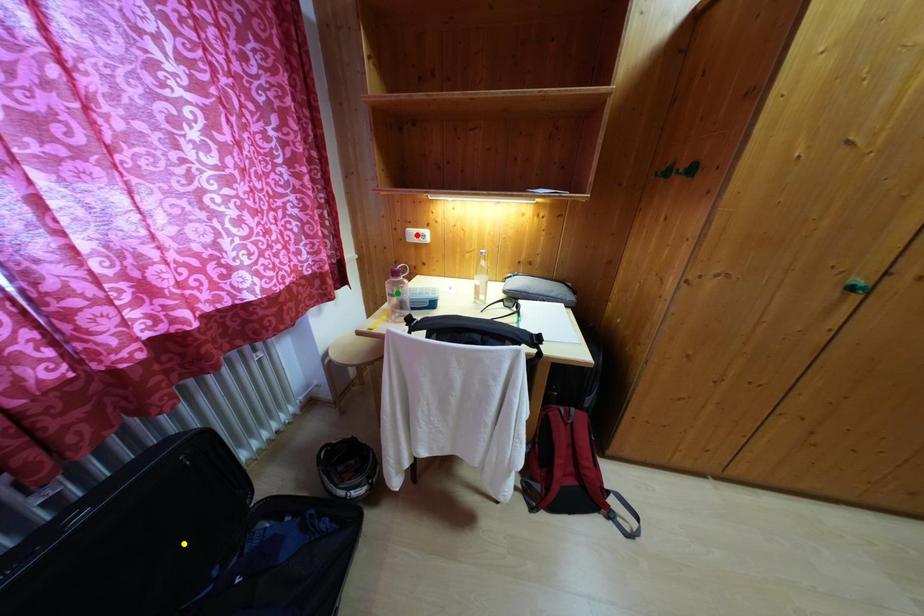
Order these from nearest to farthest:
yellow point, red point, green point

yellow point, green point, red point